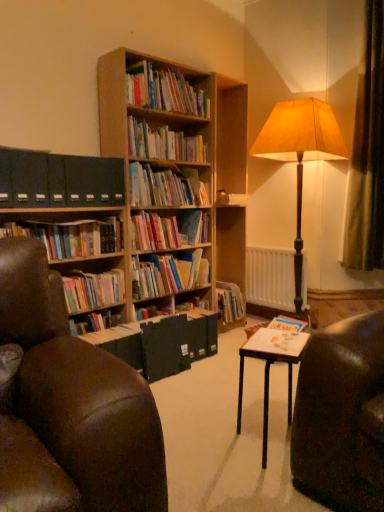
Describe the element at coordinates (168, 231) in the screenshot. I see `hardcover books at center, placed as the fourth book when sorted from bottom to top` at that location.

This screenshot has height=512, width=384. Find the location of `wooden bookcase at center`. wooden bookcase at center is located at coordinates (145, 181).

Does matte brown lampshade at right touch brown velvet curtain at right?

There is a gap between matte brown lampshade at right and brown velvet curtain at right.

Could you tell me if matte brown lampshade at right is facing brown velvet curtain at right?

No, matte brown lampshade at right is not turned towards brown velvet curtain at right.

From the image's perspective, between matte brown lampshade at right and brown velvet curtain at right, which one is located above?

brown velvet curtain at right, from the image's perspective.

Which point is more forward, (301, 131) or (370, 246)?

Point (301, 131)

In the image, is black matte file folders at left on the left side or the right side of wooden bookshelf at upper center, placed as the seventh book when sorted from bottom to top?

From the image, it's evident that black matte file folders at left is to the left of wooden bookshelf at upper center, placed as the seventh book when sorted from bottom to top.

Does black matte file folders at left have a smaller size compared to wooden bookshelf at upper center, the first book from the top?

Yes.

Does black matte file folders at left touch wooden bookshelf at upper center, placed as the seventh book when sorted from bottom to top?

black matte file folders at left and wooden bookshelf at upper center, placed as the seventh book when sorted from bottom to top, are clearly separated.

Locate an element on the screen. the 3rd book above the black matte file folders at left (from the image's perspective) is located at coordinates (164, 90).

Where is `lamp that appears on the right of black matte file folders at left`? lamp that appears on the right of black matte file folders at left is located at coordinates (300, 153).

In the scene shown: Which object is positioned more to the right, black matte file folders at left or matte brown lampshade at right?

matte brown lampshade at right.

Is black matte file folders at left bigger or smaller than matte brown lampshade at right?

Clearly, black matte file folders at left is smaller in size than matte brown lampshade at right.

Is hardcover books at center, arranged as the first book when ordered from the bottom, turned away from brown velvet curtain at right?

No.

The image size is (384, 512). I want to click on curtain above the hardcover books at center, positioned as the seventh book in top-to-bottom order (from the image's perspective), so click(367, 154).

Between point (102, 298) and point (379, 211), which one is positioned behind?

The point (379, 211) is more distant.

Is hardcover books at center, positioned as the seventh book in top-to-bottom order, wider or thinner than brown velvet curtain at right?

Clearly, hardcover books at center, positioned as the seventh book in top-to-bottom order, has less width compared to brown velvet curtain at right.

From the picture: In the image, is wooden bookshelf at upper center, the second book in the top-to-bottom sequence, on the left side or the right side of hardcover books at center, which is the 5th book in bottom-to-top order?

wooden bookshelf at upper center, the second book in the top-to-bottom sequence, is to the left of hardcover books at center, which is the 5th book in bottom-to-top order.

Between wooden bookshelf at upper center, the sixth book when ordered from bottom to top, and hardcover books at center, which is the third book in top-to-bottom order, which one has larger width?

hardcover books at center, which is the third book in top-to-bottom order, is wider.

Is wooden bookshelf at upper center, the sixth book when ordered from bottom to top, facing towards hardcover books at center, which is the third book in top-to-bottom order?

No, wooden bookshelf at upper center, the sixth book when ordered from bottom to top, is not turned towards hardcover books at center, which is the third book in top-to-bottom order.

Can you tell me how much wooden bookcase at center and matte brown lampshade at right differ in facing direction?

wooden bookcase at center and matte brown lampshade at right are facing 86.9 degrees away from each other.

Which of these two, wooden bookcase at center or matte brown lampshade at right, is thinner?

With smaller width is wooden bookcase at center.

From a real-world perspective, which is physically below, wooden bookcase at center or matte brown lampshade at right?

From a 3D spatial view, matte brown lampshade at right is below.

Locate an element on the screen. The width and height of the screenshot is (384, 512). bookcase on the left of matte brown lampshade at right is located at coordinates (145, 181).

From the image's perspective, which one is positioned lower, wooden bookshelf at upper center, the sixth book when ordered from bottom to top, or hardcover books at left, marked as the 3th book in a bottom-to-top arrangement?

hardcover books at left, marked as the 3th book in a bottom-to-top arrangement.

Is wooden bookshelf at upper center, the second book in the top-to-bottom sequence, further to the viewer compared to hardcover books at left, marked as the 3th book in a bottom-to-top arrangement?

Yes, wooden bookshelf at upper center, the second book in the top-to-bottom sequence, is further from the viewer.

From a real-world perspective, is wooden bookshelf at upper center, the second book in the top-to-bottom sequence, physically located above or below hardcover books at left, marked as the 3th book in a bottom-to-top arrangement?

From a real-world perspective, wooden bookshelf at upper center, the second book in the top-to-bottom sequence, is physically above hardcover books at left, marked as the 3th book in a bottom-to-top arrangement.

Where is `lamp in front of the brown velvet curtain at right`? The width and height of the screenshot is (384, 512). lamp in front of the brown velvet curtain at right is located at coordinates (300, 153).

Find the location of a particular element. the 3rd book counting from the right of the black matte file folders at left is located at coordinates (164, 90).

When comparing their distances from white matte radiator at center, does hardcover books at center, placed as the fourth book when sorted from bottom to top, or brown velvet curtain at right seem closer?

brown velvet curtain at right is closer to white matte radiator at center.

Based on their spatial positions, is wooden bookshelf at upper center, the first book from the top, or white matte radiator at center closer to wooden table at center?

wooden bookshelf at upper center, the first book from the top, is closer to wooden table at center.

Based on their spatial positions, is wooden table at center or hardcover books at left, marked as the 3th book in a bottom-to-top arrangement, closer to matte black book at center?

hardcover books at left, marked as the 3th book in a bottom-to-top arrangement, is positioned closer to the anchor matte black book at center.

When comparing their distances from matte brown lampshade at right, does white matte radiator at center or wooden bookshelf at upper center, placed as the seventh book when sorted from bottom to top, seem further?

Among the two, wooden bookshelf at upper center, placed as the seventh book when sorted from bottom to top, is located further to matte brown lampshade at right.

When comparing their distances from hardcover books at center, which is the 5th book in bottom-to-top order, does wooden table at center or wooden bookcase at center seem closer?

The object closer to hardcover books at center, which is the 5th book in bottom-to-top order, is wooden bookcase at center.

When comparing their distances from wooden table at center, does hardcover books at left, marked as the 3th book in a bottom-to-top arrangement, or black matte file folders at left seem further?

black matte file folders at left.

Which object lies further to the anchor point hardcover books at center, the fourth book when ordered from top to bottom, hardcover books at center, which is the third book in top-to-bottom order, or brown leather chair at left?

brown leather chair at left is positioned further to the anchor hardcover books at center, the fourth book when ordered from top to bottom.

In the scene shown: Considering their positions, is hardcover books at center, the fourth book when ordered from top to bottom, positioned further to matte black book at center than wooden bookshelf at upper center, the first book from the top?

wooden bookshelf at upper center, the first book from the top, is positioned further to the anchor matte black book at center.

The image size is (384, 512). I want to click on radiator between hardcover books at center, the fourth book when ordered from top to bottom, and matte brown lampshade at right from left to right, so click(x=270, y=278).

You are a GUI agent. You are given a task and a screenshot of the screen. Output one action in this format:
    pyautogui.click(x=<x>, y=<y>)
    Task: Click on the book situated between hardcover books at center, which is the 5th book in bottom-to-top order, and white matte radiator at center from left to right
    
    Given the screenshot: What is the action you would take?
    pyautogui.click(x=168, y=274)

This screenshot has height=512, width=384. Find the location of `lamp between brown velvet curtain at right and white matte radiator at center vertically`. lamp between brown velvet curtain at right and white matte radiator at center vertically is located at coordinates point(300,153).

Identify the location of paperback book between black matte file folders at left and matte brown lampshade at right from left to right. The width and height of the screenshot is (384, 512). (165, 347).